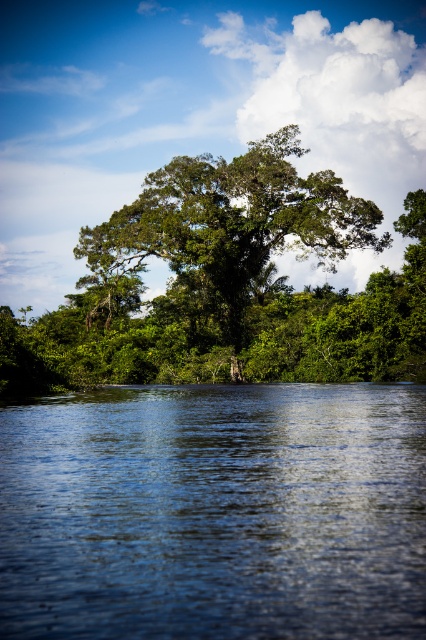
In the scene shown: Is blue liquid water at lower center thinner than green leafy tree at center?

Correct, blue liquid water at lower center's width is less than green leafy tree at center's.

Can you confirm if blue liquid water at lower center is positioned below green leafy tree at center?

Correct, blue liquid water at lower center is located below green leafy tree at center.

Is point (152, 547) less distant than point (255, 161)?

Yes, point (152, 547) is closer to viewer.

You are a GUI agent. You are given a task and a screenshot of the screen. Output one action in this format:
    pyautogui.click(x=<x>, y=<y>)
    Task: Click on the blue liquid water at lower center
    This screenshot has width=426, height=640.
    Given the screenshot: What is the action you would take?
    pyautogui.click(x=215, y=513)